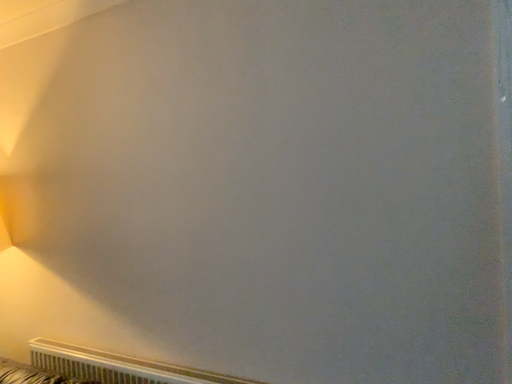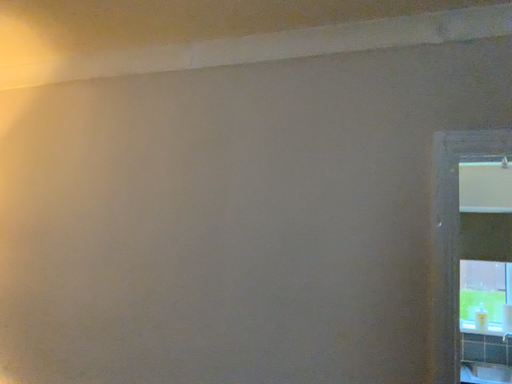
Question: How did the camera likely rotate when shooting the video?

Choices:
 (A) rotated left
 (B) rotated right

Answer: (B)